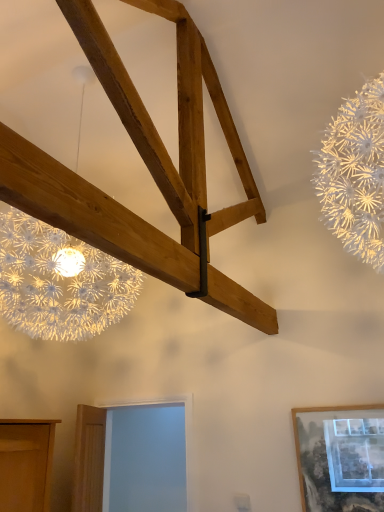
I want to click on blue glass window at lower center, so click(110, 452).

This screenshot has width=384, height=512. Describe the element at coordinates (110, 452) in the screenshot. I see `blue glass window at lower center` at that location.

The width and height of the screenshot is (384, 512). Identify the location of matte wooden picture frame at lower right. (340, 458).

What do you see at coordinates (340, 458) in the screenshot?
I see `matte wooden picture frame at lower right` at bounding box center [340, 458].

Find the location of a particular element. The image size is (384, 512). blue glass window at lower center is located at coordinates (110, 452).

In the image, is matte wooden picture frame at lower right on the left side or the right side of blue glass window at lower center?

matte wooden picture frame at lower right is to the right of blue glass window at lower center.

Is matte wooden picture frame at lower right positioned before blue glass window at lower center?

Yes, matte wooden picture frame at lower right is in front of blue glass window at lower center.

Considering the positions of points (351, 424) and (182, 397), is point (351, 424) closer to camera compared to point (182, 397)?

Yes, it is.

From the image's perspective, is matte wooden picture frame at lower right on blue glass window at lower center?

Yes.

From a real-world perspective, which object stands above the other?

In real-world perspective, blue glass window at lower center is above.

Does matte wooden picture frame at lower right have a lesser width compared to blue glass window at lower center?

Yes, matte wooden picture frame at lower right is thinner than blue glass window at lower center.

Considering the sizes of matte wooden picture frame at lower right and blue glass window at lower center in the image, is matte wooden picture frame at lower right taller or shorter than blue glass window at lower center?

In the image, matte wooden picture frame at lower right appears to be shorter than blue glass window at lower center.

Based on their sizes in the image, would you say matte wooden picture frame at lower right is bigger or smaller than blue glass window at lower center?

matte wooden picture frame at lower right is smaller than blue glass window at lower center.

Is matte wooden picture frame at lower right inside or outside of blue glass window at lower center?

matte wooden picture frame at lower right is located beyond the bounds of blue glass window at lower center.

Is there a large distance between matte wooden picture frame at lower right and blue glass window at lower center?

Absolutely, matte wooden picture frame at lower right is distant from blue glass window at lower center.

Is matte wooden picture frame at lower right turned away from blue glass window at lower center?

No, matte wooden picture frame at lower right is not facing away from blue glass window at lower center.

How different are the orientations of matte wooden picture frame at lower right and blue glass window at lower center in degrees?

The facing directions of matte wooden picture frame at lower right and blue glass window at lower center are 0.785 degrees apart.

At what (x,y) coordinates should I click in order to perform the action: click on picture frame below the blue glass window at lower center (from a real-world perspective). Please return your answer as a coordinate pair (x, y). This screenshot has width=384, height=512. Looking at the image, I should click on (340, 458).

Which object is positioned more to the right, blue glass window at lower center or matte wooden picture frame at lower right?

From the viewer's perspective, matte wooden picture frame at lower right appears more on the right side.

Between blue glass window at lower center and matte wooden picture frame at lower right, which one is positioned in front?

matte wooden picture frame at lower right is closer to the camera.

Which is further, (90, 461) or (323, 490)?

Positioned behind is point (90, 461).

From the image's perspective, is blue glass window at lower center on matte wooden picture frame at lower right?

No, from the image's perspective, blue glass window at lower center is not over matte wooden picture frame at lower right.

From a real-world perspective, is blue glass window at lower center positioned under matte wooden picture frame at lower right based on gravity?

No, from a real-world perspective, blue glass window at lower center is not beneath matte wooden picture frame at lower right.

Considering the relative sizes of blue glass window at lower center and matte wooden picture frame at lower right in the image provided, is blue glass window at lower center thinner than matte wooden picture frame at lower right?

No, blue glass window at lower center is not thinner than matte wooden picture frame at lower right.

Between blue glass window at lower center and matte wooden picture frame at lower right, which one has more height?

blue glass window at lower center is taller.

Considering the sizes of blue glass window at lower center and matte wooden picture frame at lower right in the image, is blue glass window at lower center bigger or smaller than matte wooden picture frame at lower right?

In the image, blue glass window at lower center appears to be larger than matte wooden picture frame at lower right.

Is blue glass window at lower center positioned beyond the bounds of matte wooden picture frame at lower right?

That's correct, blue glass window at lower center is outside of matte wooden picture frame at lower right.

Is blue glass window at lower center placed right next to matte wooden picture frame at lower right?

blue glass window at lower center and matte wooden picture frame at lower right are clearly separated.

Could you tell me if blue glass window at lower center is turned towards matte wooden picture frame at lower right?

No, blue glass window at lower center is not turned towards matte wooden picture frame at lower right.

Find the location of a particular element. picture frame below the blue glass window at lower center (from a real-world perspective) is located at coordinates (340, 458).

The height and width of the screenshot is (512, 384). In order to click on picture frame on the right of blue glass window at lower center in this screenshot , I will do `click(340, 458)`.

You are a GUI agent. You are given a task and a screenshot of the screen. Output one action in this format:
    pyautogui.click(x=<x>, y=<y>)
    Task: Click on the window positioned vertically above the matte wooden picture frame at lower right (from a real-world perspective)
    This screenshot has width=384, height=512.
    Given the screenshot: What is the action you would take?
    pyautogui.click(x=110, y=452)